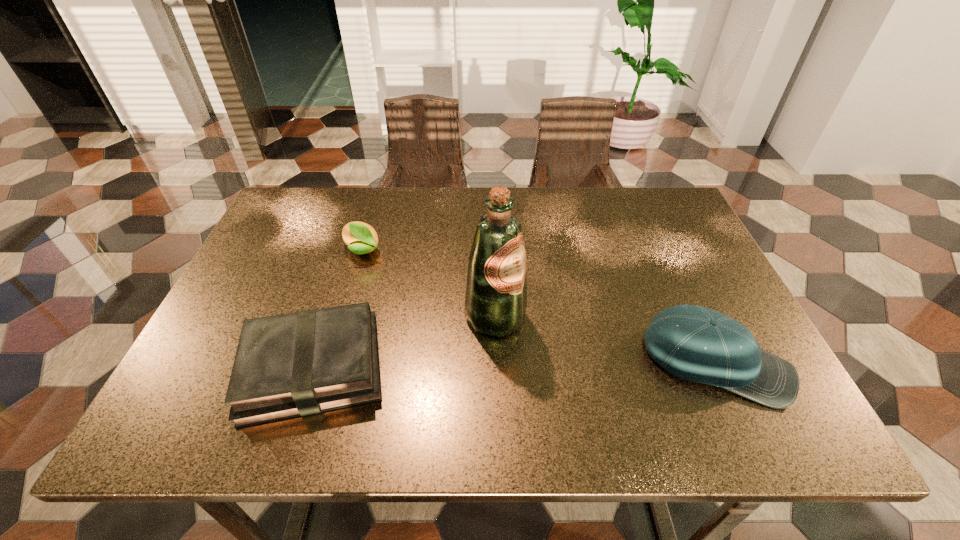
Find the location of a particular element. This screenshot has height=540, width=960. unoccupied position between the olive oil and the second shortest object is located at coordinates (429, 284).

Where is `vacant space that is in between the shortest object and the third shortest object`? This screenshot has width=960, height=540. vacant space that is in between the shortest object and the third shortest object is located at coordinates (515, 366).

Locate an element on the screen. The width and height of the screenshot is (960, 540). vacant area between the third tallest object and the olive oil is located at coordinates (429, 284).

This screenshot has width=960, height=540. I want to click on vacant space that is in between the third tallest object and the second tallest object, so click(540, 307).

What are the coordinates of `vacant area between the third object from left to right and the farthest object` in the screenshot? It's located at (429, 284).

Locate which object is the third closest to the rightmost object. Please provide its 2D coordinates. Your answer should be formatted as a tuple, i.e. [(x, y)], where the tuple contains the x and y coordinates of a point satisfying the conditions above.

[(361, 238)]

At what (x,y) coordinates should I click in order to perform the action: click on the third closest object relative to the shortest object. Please return your answer as a coordinate pair (x, y). Image resolution: width=960 pixels, height=540 pixels. Looking at the image, I should click on (695, 343).

Identify the location of free spot that satisfies the following two spatial constraints: 1. on the back side of the third tallest object; 2. on the right side of the book. (350, 251).

Find the location of a particular element. vacant space that satisfies the following two spatial constraints: 1. on the front side of the farthest object; 2. on the left side of the second tallest object is located at coordinates (331, 363).

Where is `vacant space that satisfies the following two spatial constraints: 1. on the front side of the rightmost object; 2. on the left side of the lemon`? Image resolution: width=960 pixels, height=540 pixels. vacant space that satisfies the following two spatial constraints: 1. on the front side of the rightmost object; 2. on the left side of the lemon is located at coordinates (331, 363).